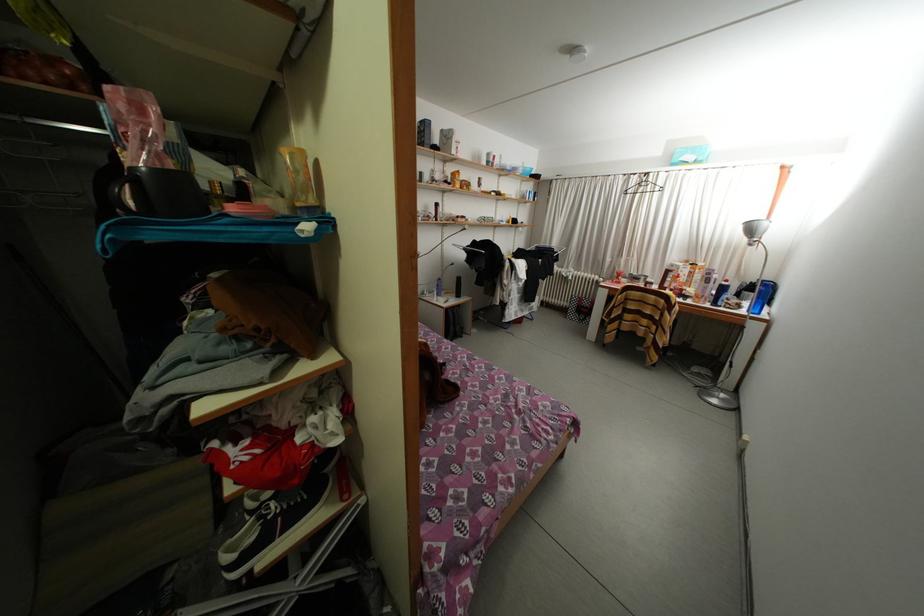
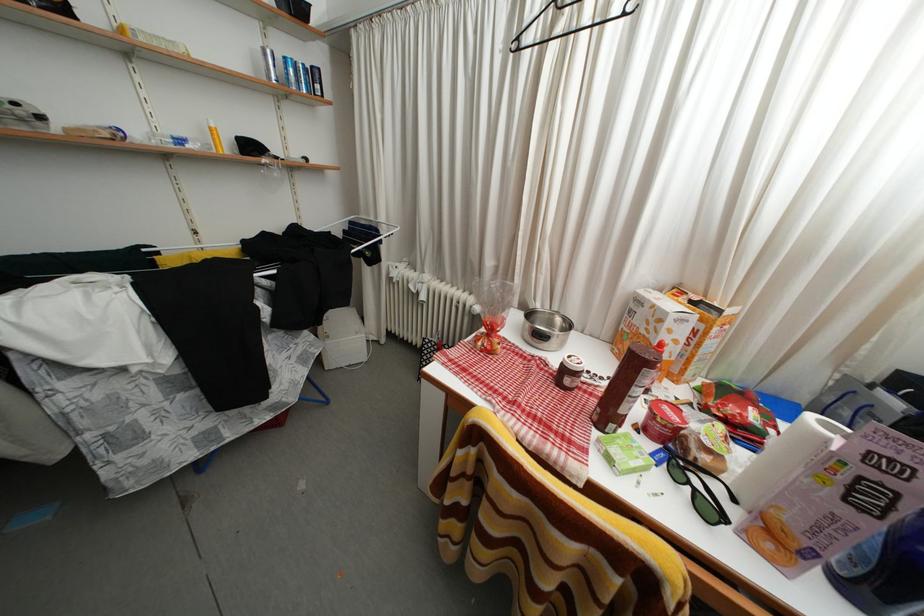
What movement of the cameraman would produce the second image?

The cameraman moved toward right, forward.